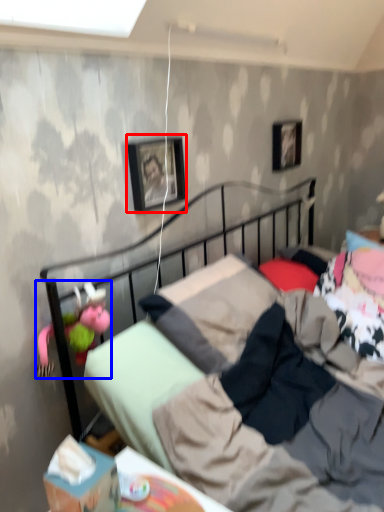
Question: Which point is closer to the camera, picture frame (highlighted by a red box) or doll (highlighted by a blue box)?

Choices:
 (A) picture frame
 (B) doll

Answer: (B)